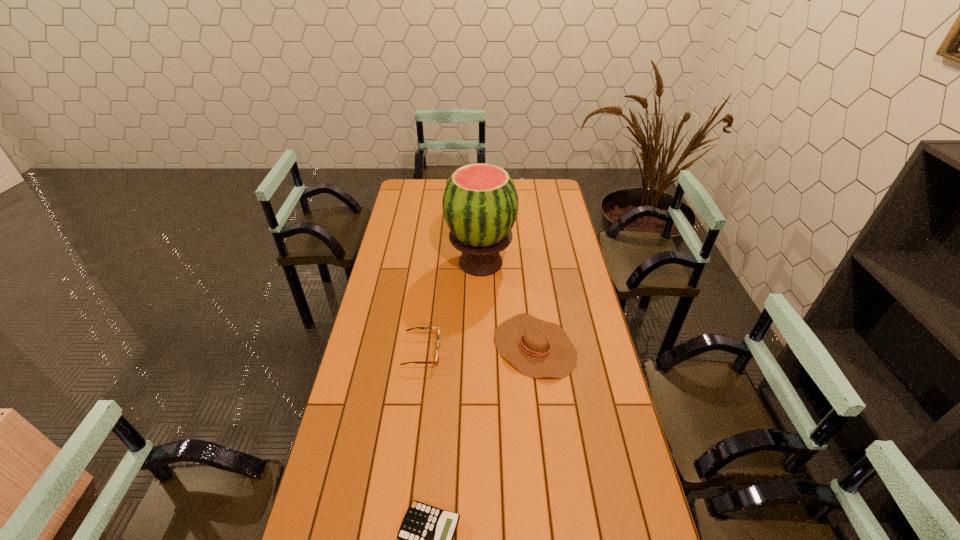
At what (x,y) coordinates should I click in order to perform the action: click on blank area in the image that satisfies the following two spatial constraints: 1. on the front side of the tallest object; 2. on the frame of the spectacles. Please return your answer as a coordinate pair (x, y). This screenshot has height=540, width=960. Looking at the image, I should click on (481, 352).